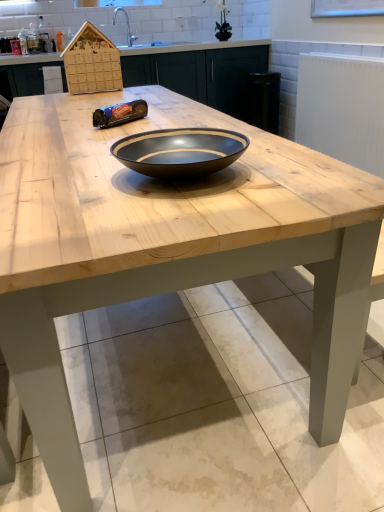
At what (x,y) coordinates should I click in order to perform the action: click on black glossy bowl at center. Please return your answer as a coordinate pair (x, y). Looking at the image, I should click on (180, 151).

Where is `white textured radiator at upper right`? white textured radiator at upper right is located at coordinates (342, 108).

Which is correct: wooden cabinetry at center is inside black glossy bowl at center, or outside of it?

wooden cabinetry at center is spatially situated outside black glossy bowl at center.

Is wooden cabinetry at center oriented away from black glossy bowl at center?

No, wooden cabinetry at center's orientation is not away from black glossy bowl at center.

Considering the sizes of wooden cabinetry at center and black glossy bowl at center in the image, is wooden cabinetry at center taller or shorter than black glossy bowl at center?

Clearly, wooden cabinetry at center is taller compared to black glossy bowl at center.

From the image's perspective, is wooden cabinetry at center beneath black glossy bowl at center?

Incorrect, from the image's perspective, wooden cabinetry at center is higher than black glossy bowl at center.

Where is `cabinetry lying behind the white textured radiator at upper right`? This screenshot has width=384, height=512. cabinetry lying behind the white textured radiator at upper right is located at coordinates (200, 73).

Is wooden cabinetry at center at the right side of white textured radiator at upper right?

No.

From the picture: From a real-world perspective, who is located higher, wooden cabinetry at center or white textured radiator at upper right?

wooden cabinetry at center is physically above.

Considering the relative sizes of white textured radiator at upper right and black glossy bowl at center in the image provided, is white textured radiator at upper right wider than black glossy bowl at center?

Incorrect, the width of white textured radiator at upper right does not surpass that of black glossy bowl at center.

Is black glossy bowl at center completely or partially inside white textured radiator at upper right?

No, black glossy bowl at center is located outside of white textured radiator at upper right.

What's the angular difference between white textured radiator at upper right and black glossy bowl at center's facing directions?

89.2 degrees separate the facing orientations of white textured radiator at upper right and black glossy bowl at center.

Does point (340, 142) appear closer or farther from the camera than point (196, 146)?

Clearly, point (340, 142) is more distant from the camera than point (196, 146).

Is white textured radiator at upper right inside the boundaries of wooden cabinetry at center, or outside?

white textured radiator at upper right lies outside wooden cabinetry at center.

Is white textured radiator at upper right taller than wooden cabinetry at center?

No, white textured radiator at upper right is not taller than wooden cabinetry at center.

Is white textured radiator at upper right in contact with wooden cabinetry at center?

white textured radiator at upper right is not next to wooden cabinetry at center, and they're not touching.

Which is in front, white textured radiator at upper right or wooden cabinetry at center?

white textured radiator at upper right is in front.

Does black glossy bowl at center contain wooden cabinetry at center?

Definitely not — wooden cabinetry at center is not inside black glossy bowl at center.

From the image's perspective, relative to wooden cabinetry at center, is black glossy bowl at center above or below?

From the image's perspective, black glossy bowl at center appears below wooden cabinetry at center.

This screenshot has width=384, height=512. I want to click on bowl above the wooden cabinetry at center (from a real-world perspective), so click(x=180, y=151).

From a real-world perspective, is black glossy bowl at center positioned over white textured radiator at upper right based on gravity?

Yes.

Are black glossy bowl at center and white textured radiator at upper right making contact?

No, black glossy bowl at center is not touching white textured radiator at upper right.

Which point is more forward, (178, 145) or (335, 89)?

The point (178, 145) is in front.

Considering the relative sizes of black glossy bowl at center and white textured radiator at upper right in the image provided, is black glossy bowl at center smaller than white textured radiator at upper right?

Indeed, black glossy bowl at center has a smaller size compared to white textured radiator at upper right.

At what (x,y) coordinates should I click in order to perform the action: click on bowl that appears in front of the wooden cabinetry at center. Please return your answer as a coordinate pair (x, y). The width and height of the screenshot is (384, 512). Looking at the image, I should click on (180, 151).

Identify the location of radiator below the wooden cabinetry at center (from a real-world perspective). (342, 108).

Estimate the real-world distances between objects in this image. Which object is further from white textured radiator at upper right, black glossy bowl at center or wooden cabinetry at center?

black glossy bowl at center is positioned further to the anchor white textured radiator at upper right.

Estimate the real-world distances between objects in this image. Which object is further from white textured radiator at upper right, wooden cabinetry at center or black glossy bowl at center?

The object further to white textured radiator at upper right is black glossy bowl at center.

Considering their positions, is black glossy bowl at center positioned closer to wooden cabinetry at center than white textured radiator at upper right?

white textured radiator at upper right is closer to wooden cabinetry at center.

Estimate the real-world distances between objects in this image. Which object is closer to black glossy bowl at center, wooden cabinetry at center or white textured radiator at upper right?

white textured radiator at upper right is positioned closer to the anchor black glossy bowl at center.

From the image, which object appears to be nearer to black glossy bowl at center, white textured radiator at upper right or wooden cabinetry at center?

white textured radiator at upper right.

Which object lies further to the anchor point wooden cabinetry at center, white textured radiator at upper right or black glossy bowl at center?

Based on the image, black glossy bowl at center appears to be further to wooden cabinetry at center.

Where is `radiator positioned between black glossy bowl at center and wooden cabinetry at center from near to far`? This screenshot has width=384, height=512. radiator positioned between black glossy bowl at center and wooden cabinetry at center from near to far is located at coordinates (342, 108).